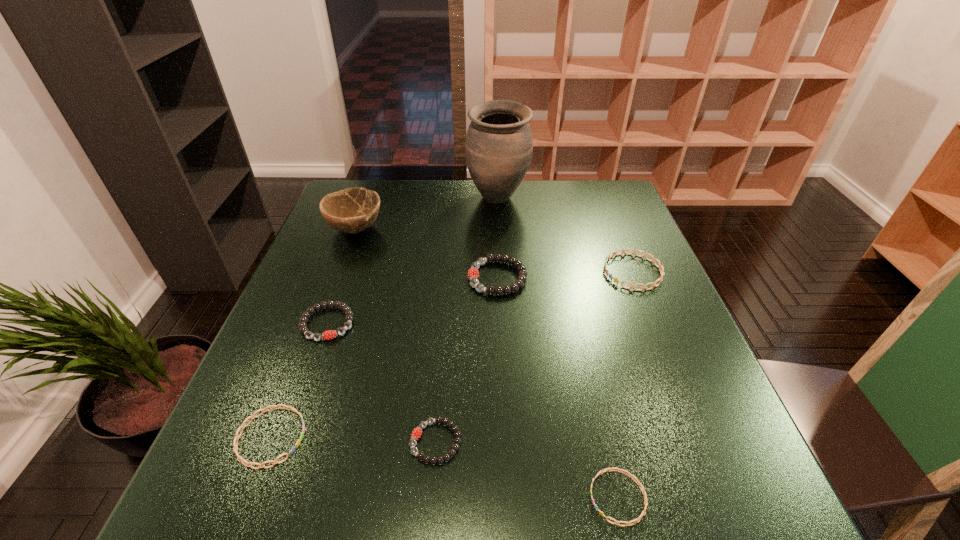
In order to click on free space located on the surface of the leftmost blue bracelet showing star-shaped elements in this screenshot , I will do `click(490, 437)`.

Where is `free space located 0.270m on the back of the smallest black bracelet`? This screenshot has width=960, height=540. free space located 0.270m on the back of the smallest black bracelet is located at coordinates (445, 314).

Where is `vacant space located 0.200m on the surface of the second blue bracelet from right to left showing star-shaped elements`? The image size is (960, 540). vacant space located 0.200m on the surface of the second blue bracelet from right to left showing star-shaped elements is located at coordinates (466, 497).

Identify the location of blank space located 0.060m on the surface of the second blue bracelet from right to left showing star-shaped elements. (553, 497).

You are a GUI agent. You are given a task and a screenshot of the screen. Output one action in this format:
    pyautogui.click(x=<x>, y=<y>)
    Task: Click on the vacant space positioned on the surface of the second blue bracelet from right to left showing star-shaped elements
    The width and height of the screenshot is (960, 540).
    Given the screenshot: What is the action you would take?
    pyautogui.click(x=453, y=497)

You are a GUI agent. You are given a task and a screenshot of the screen. Output one action in this format:
    pyautogui.click(x=<x>, y=<y>)
    Task: Click on the urn at the far edge
    The image size is (960, 540).
    Given the screenshot: What is the action you would take?
    pyautogui.click(x=498, y=149)

Where is `bowl located in the far edge section of the desktop`? This screenshot has width=960, height=540. bowl located in the far edge section of the desktop is located at coordinates (352, 210).

I want to click on object situated at the near edge, so click(640, 517).

Image resolution: width=960 pixels, height=540 pixels. What are the coordinates of `bowl that is positioned at the left edge` in the screenshot? It's located at (352, 210).

This screenshot has height=540, width=960. Identify the location of object that is at the right edge. (659, 266).